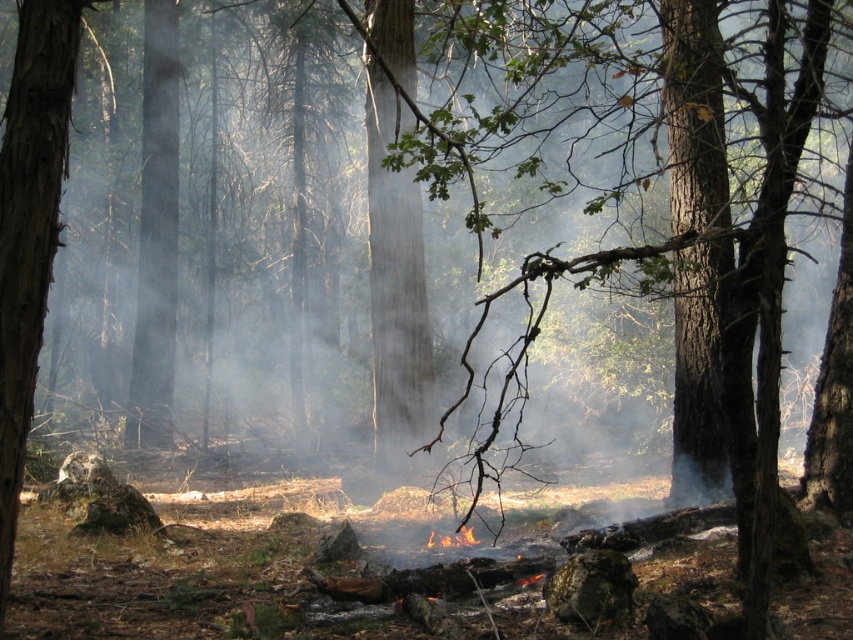
Question: Can you confirm if smooth bark tree at left is positioned above charred wood pile at center?

Choices:
 (A) yes
 (B) no

Answer: (A)

Question: Which object is farther from the camera taking this photo?

Choices:
 (A) smooth bark tree at left
 (B) charred wood pile at center

Answer: (B)

Question: Is smooth bark tree at left bigger than charred wood pile at center?

Choices:
 (A) yes
 (B) no

Answer: (A)

Question: Which point is farther to the camera?

Choices:
 (A) (10, 467)
 (B) (469, 538)

Answer: (B)

Question: Is smooth bark tree at left wider than charred wood pile at center?

Choices:
 (A) yes
 (B) no

Answer: (A)